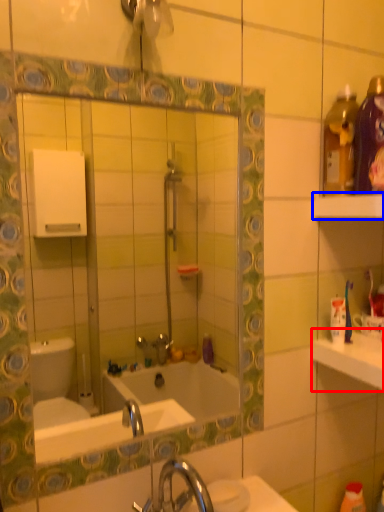
Question: Which object appears farthest to the camera in this image, counter top (highlighted by a red box) or shelf (highlighted by a blue box)?

Choices:
 (A) counter top
 (B) shelf

Answer: (A)